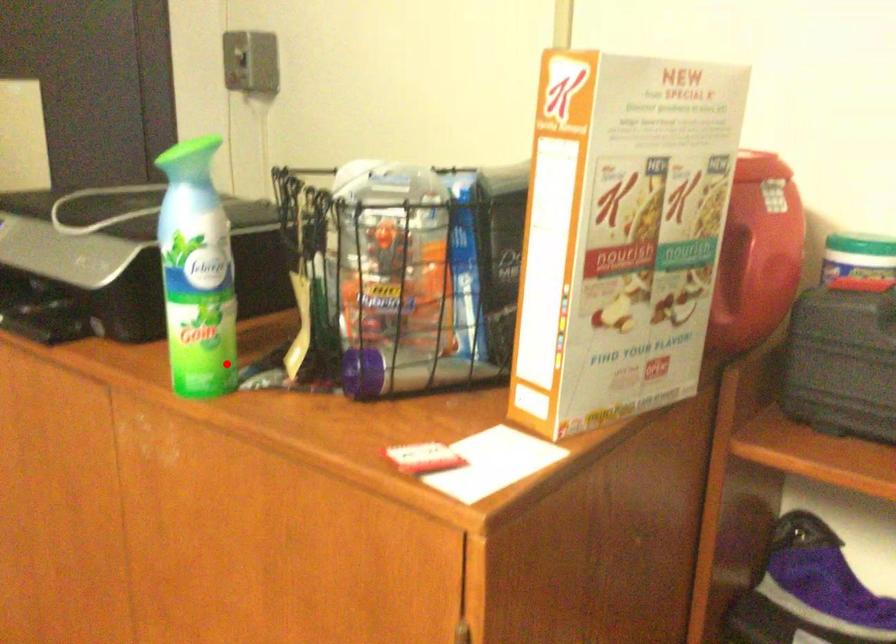
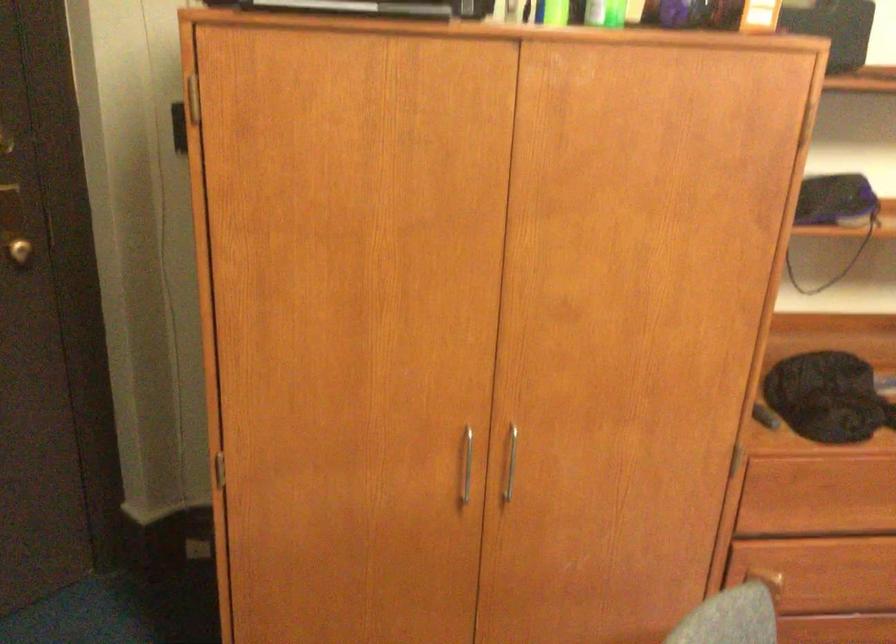
Question: I am providing you with two images of the same scene from different viewpoints. In image1, a red point is highlighted. Considering the same 3D point in image2, which of the following is correct?

Choices:
 (A) It is closer
 (B) It is farther

Answer: (B)